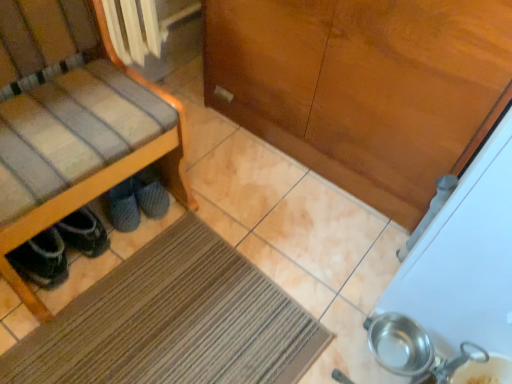
Find the location of `spots to the right of wooden chair at left`. spots to the right of wooden chair at left is located at coordinates (226, 247).